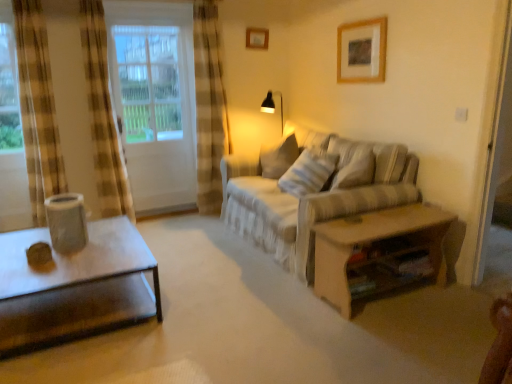
Locate an element on the screen. This screenshot has width=512, height=384. free spot in front of white glass door at left is located at coordinates point(166,231).